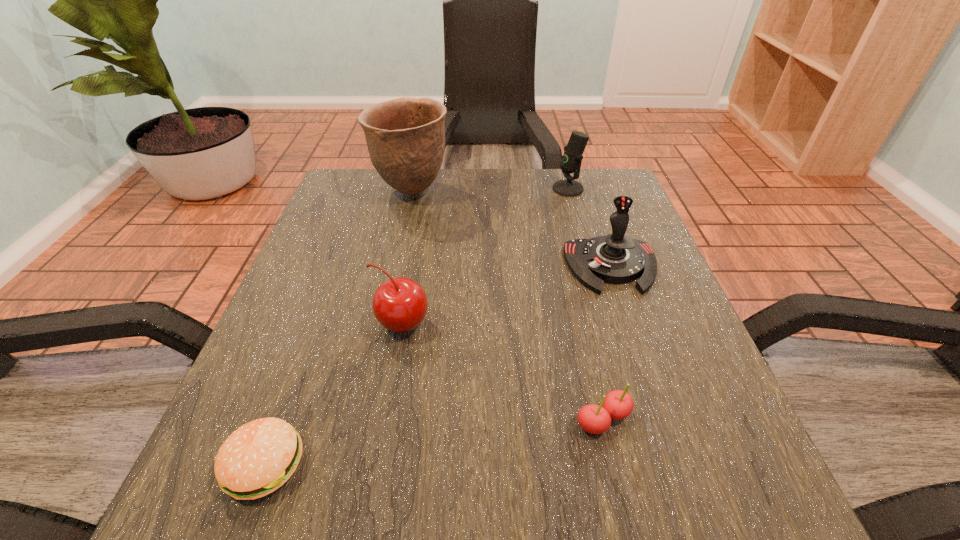
Where is `joystick positioned at the right edge`? This screenshot has width=960, height=540. joystick positioned at the right edge is located at coordinates (617, 259).

At what (x,y) coordinates should I click in order to perform the action: click on cherry at the right edge. Please return your answer as a coordinate pair (x, y). The image size is (960, 540). Looking at the image, I should click on (595, 419).

Locate an element on the screen. object present at the far left corner is located at coordinates click(x=405, y=137).

Where is `object present at the near left corner`? object present at the near left corner is located at coordinates (259, 457).

Where is `object that is positioned at the far right corner`? The height and width of the screenshot is (540, 960). object that is positioned at the far right corner is located at coordinates (571, 160).

In the image, there is a desktop. Identify the location of free space at the far edge. This screenshot has width=960, height=540. (527, 208).

This screenshot has height=540, width=960. Find the location of `free space at the left edge of the desktop`. free space at the left edge of the desktop is located at coordinates (292, 374).

Locate an element on the screen. free space at the right edge of the desktop is located at coordinates (660, 379).

Identify the location of vacant space at the far left corner. This screenshot has height=540, width=960. (379, 192).

Where is `free space at the near left corner of the desktop`? free space at the near left corner of the desktop is located at coordinates (230, 524).